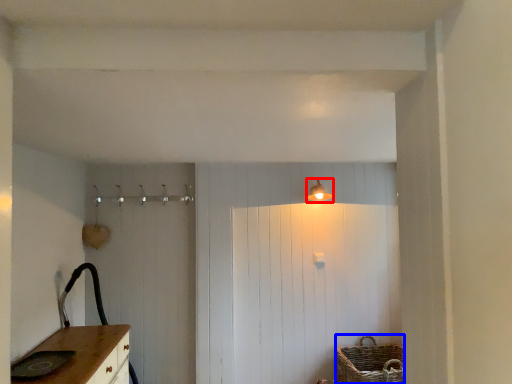
Question: Which object is closer to the camera taking this photo, light fixture (highlighted by a red box) or basket (highlighted by a blue box)?

Choices:
 (A) light fixture
 (B) basket

Answer: (B)